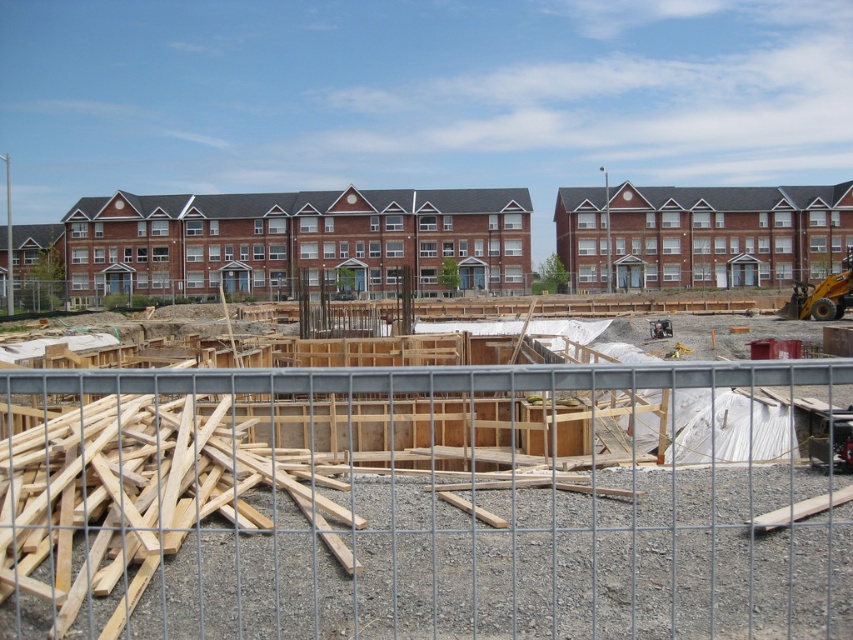
Is gray metal fence at center behind brick building at center?

No, it is in front of brick building at center.

Is gray metal fence at center positioned in front of brick building at center?

That is True.

Is point (566, 628) in front of point (804, 209)?

Yes, point (566, 628) is closer to viewer.

The height and width of the screenshot is (640, 853). Find the location of `gray metal fence at center`. gray metal fence at center is located at coordinates (422, 504).